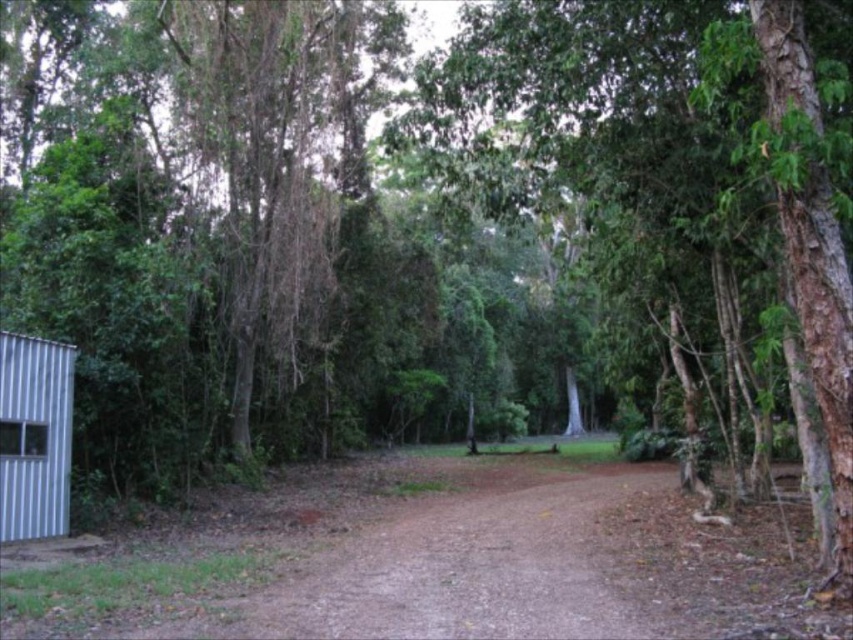
Question: Does green leafy tree at center lie in front of silver corrugated hut at left?

Choices:
 (A) yes
 (B) no

Answer: (A)

Question: Which of the following is the closest to the observer?

Choices:
 (A) (788, 45)
 (B) (6, 432)

Answer: (A)

Question: Can you confirm if green leafy tree at center is positioned to the right of silver corrugated hut at left?

Choices:
 (A) yes
 (B) no

Answer: (A)

Question: Is green leafy tree at center wider than silver corrugated hut at left?

Choices:
 (A) no
 (B) yes

Answer: (B)

Question: Which of the following is the farthest from the observer?

Choices:
 (A) silver corrugated hut at left
 (B) green leafy tree at center

Answer: (A)